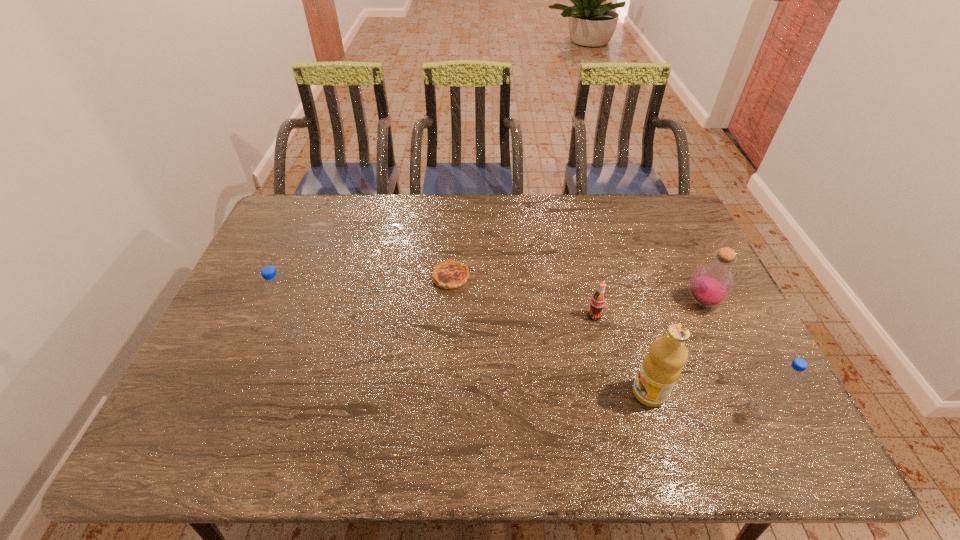
This screenshot has width=960, height=540. In order to click on vacant area that lies between the leftmost object and the shorter water bottle in this screenshot , I will do `click(528, 374)`.

At what (x,y) coordinates should I click in order to perform the action: click on vacant point located between the bottle and the leftmost object. Please return your answer as a coordinate pair (x, y). Looking at the image, I should click on [500, 319].

In order to click on empty space that is in between the fourth object from left to right and the nearer water bottle in this screenshot , I will do `click(704, 402)`.

Find the location of a particular element. free space between the third object from right to left and the second object from left to right is located at coordinates [550, 335].

At what (x,y) coordinates should I click in order to perform the action: click on vacant point located between the olive oil and the leftmost object. Please return your answer as a coordinate pair (x, y). The height and width of the screenshot is (540, 960). Looking at the image, I should click on coord(473,364).

Choose which object is the third nearest neighbor to the right water bottle. Please provide its 2D coordinates. Your answer should be formatted as a tuple, i.e. [(x, y)], where the tuple contains the x and y coordinates of a point satisfying the conditions above.

[(597, 303)]

This screenshot has width=960, height=540. I want to click on object that is the closest one to the fourth object from right to left, so click(661, 368).